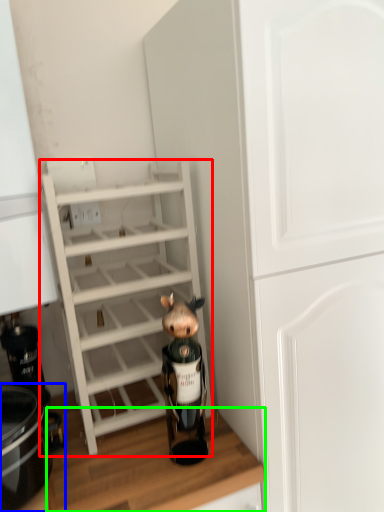
Question: Which object is the farthest from shelf (highlighted by a red box)? Choose among these: crock pot (highlighted by a blue box) or counter top (highlighted by a green box).

Choices:
 (A) crock pot
 (B) counter top

Answer: (A)